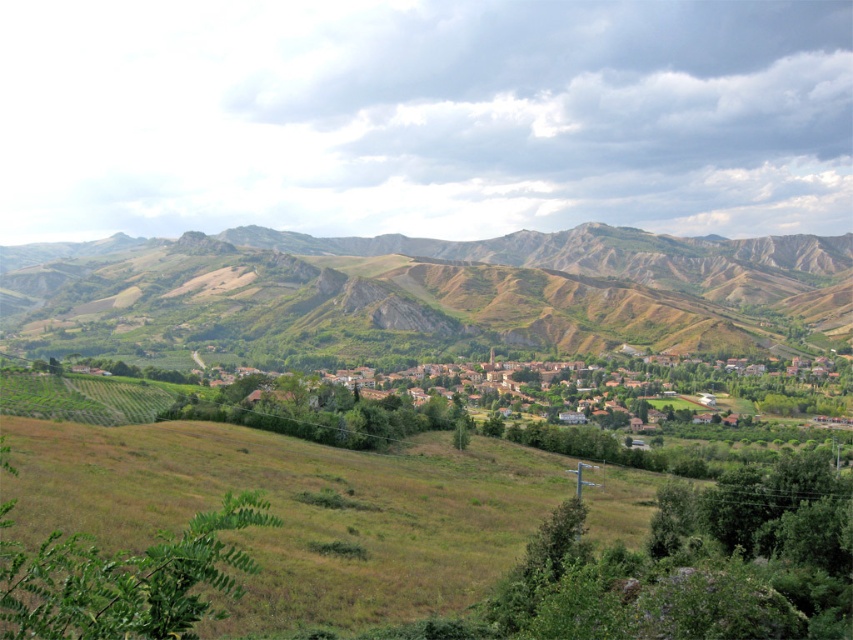
Measure the distance between green grassy hillside at center and brown tiled roofs at center.

130.00 meters

Who is taller, green grassy hillside at center or brown tiled roofs at center?

With more height is green grassy hillside at center.

Is point (277, 332) positioned behind point (635, 396)?

Yes.

Identify the location of green grassy hillside at center. Image resolution: width=853 pixels, height=640 pixels. tap(440, 288).